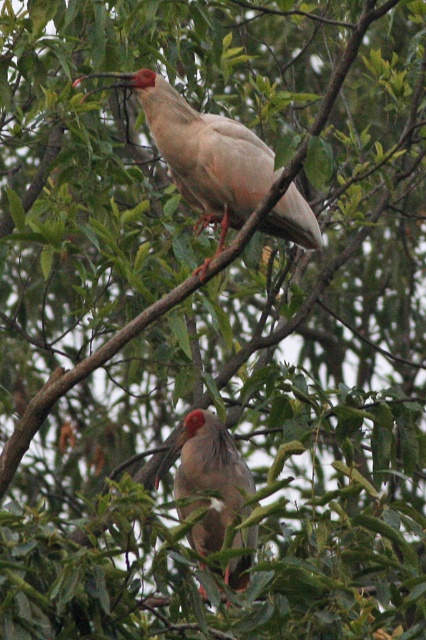
Is matte white bird at upper center taller than matte gray bird at center?

Yes.

Where is `matte white bird at upper center`? matte white bird at upper center is located at coordinates (203, 152).

Locate an element on the screen. The height and width of the screenshot is (640, 426). matte white bird at upper center is located at coordinates (203, 152).